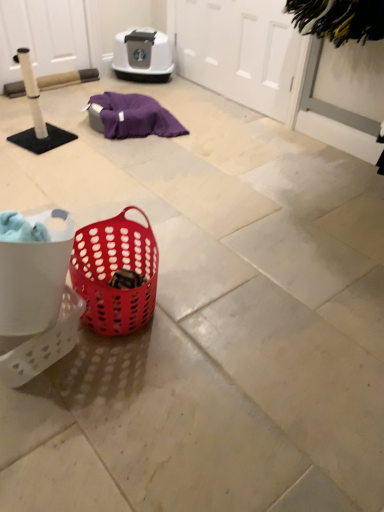
You are a GUI agent. You are given a task and a screenshot of the screen. Output one action in this format:
    pyautogui.click(x=<x>, y=<y>)
    Task: Click on the unoccupied region to the right of white perforated basket at lower left
    The width and height of the screenshot is (384, 512).
    Given the screenshot: What is the action you would take?
    pyautogui.click(x=122, y=381)